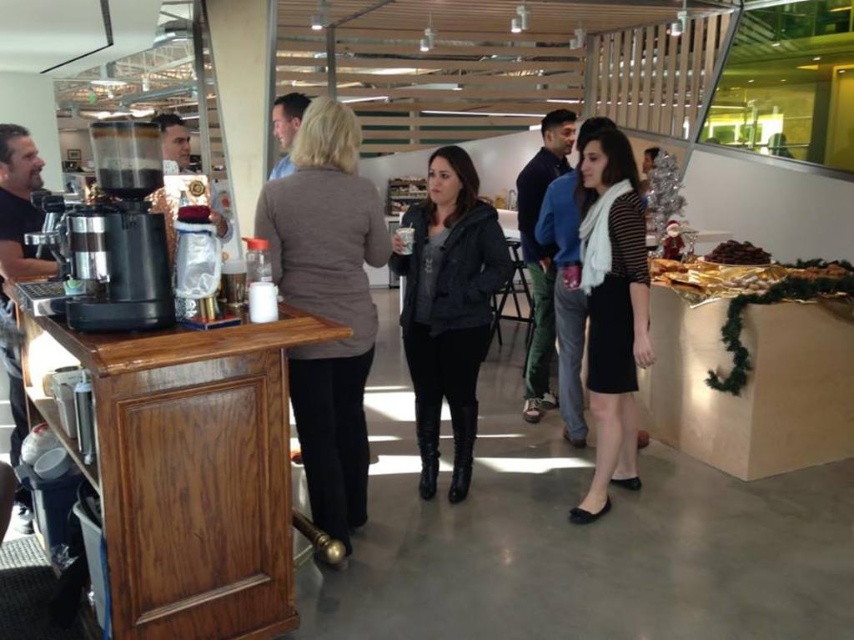
You are standing at the entrance of the room and want to quickly locate the metallic silver coffee machine at left. According to the coordinates provided, where should you look relative to the entrance?

The metallic silver coffee machine at left is located at coordinates point (127,234), which means it is positioned approximately 36.7 percent from the left edge and 15.1 percent from the bottom edge of the image. To locate it from the entrance, you should look towards the left side of the room, slightly lower than the center.

You are standing in the open space of the coffee area and want to reach both the point at coordinates point [367,308] and the point at coordinates point [764,256]. Which point will you reach first?

You will reach the point at coordinates point [367,308] first because it is closer to you than the point at coordinates point [764,256].

You are organizing a small event and need to place a decorative item on the wooden counter. The brown woolen sweater at center and the dark brown roasted beans at upper right are both candidates. Which item requires more horizontal space on the counter?

The brown woolen sweater at center requires more horizontal space on the counter because its width is larger than the dark brown roasted beans at upper right.